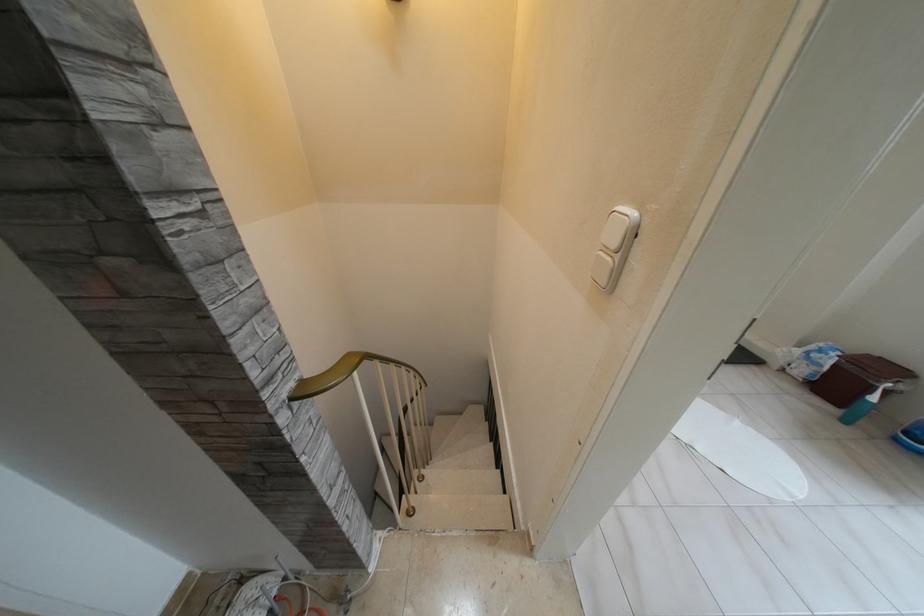
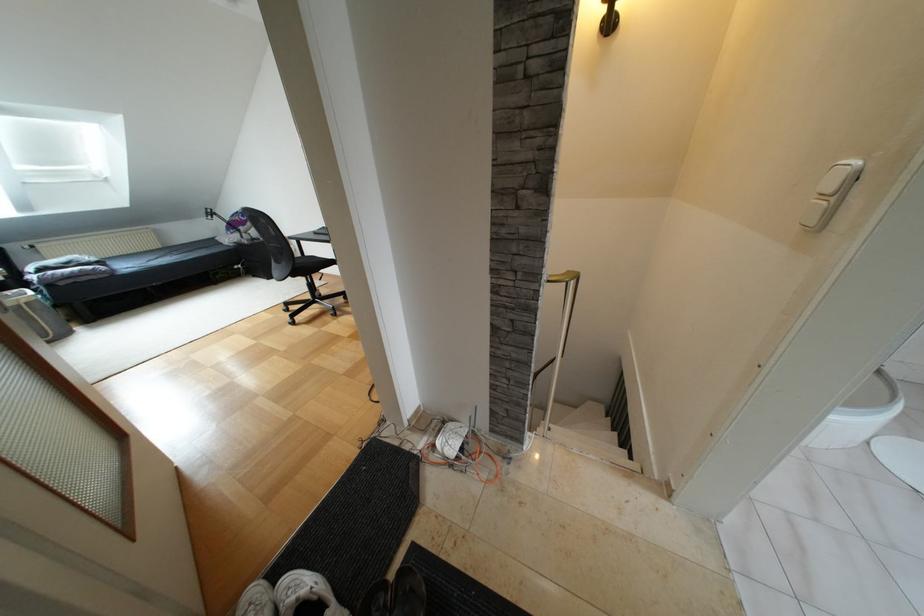
Find the pixel in the second image that matches the point at 617,256 in the first image.

(833, 198)